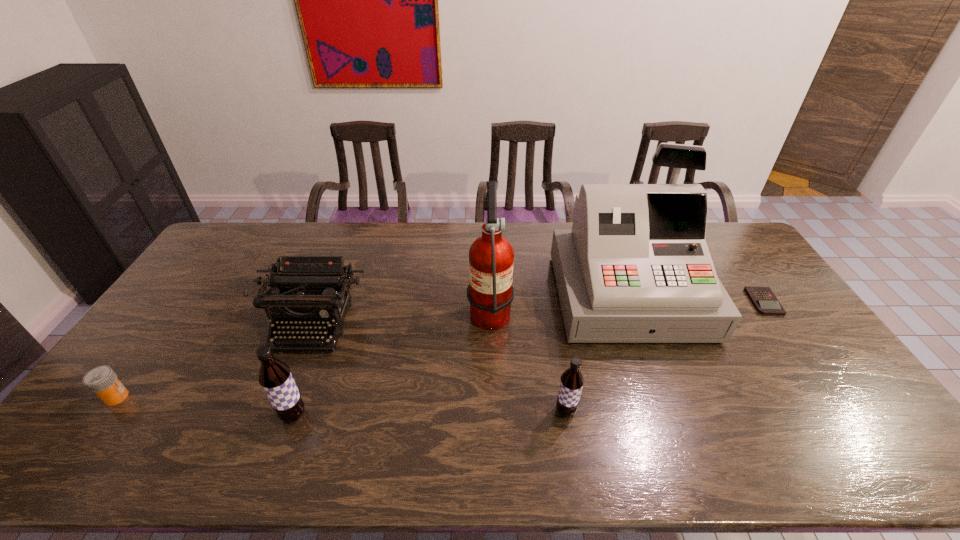
Where is `vacant area that lies between the fourth object from right to left and the typewriter`? The width and height of the screenshot is (960, 540). vacant area that lies between the fourth object from right to left and the typewriter is located at coordinates (401, 317).

Identify the location of empty space that is in between the second object from right to left and the sixth tallest object. (372, 346).

Where is `free spot between the fourth object from right to left and the shorter root beer`? The image size is (960, 540). free spot between the fourth object from right to left and the shorter root beer is located at coordinates (528, 360).

Where is `vacant area that lies between the right root beer and the third tallest object`? Image resolution: width=960 pixels, height=540 pixels. vacant area that lies between the right root beer and the third tallest object is located at coordinates (429, 413).

Where is `free area in between the fourth object from left to right and the second object from right to left`? The image size is (960, 540). free area in between the fourth object from left to right and the second object from right to left is located at coordinates (559, 302).

Locate an element on the screen. This screenshot has width=960, height=540. free space between the calculator and the shorter root beer is located at coordinates (664, 356).

I want to click on free space between the shorter root beer and the medicine, so click(341, 404).

The image size is (960, 540). I want to click on vacant point located between the fourth object from right to left and the sixth tallest object, so click(x=303, y=353).

Image resolution: width=960 pixels, height=540 pixels. Find the location of `free point between the left root beer and the second object from right to left`. free point between the left root beer and the second object from right to left is located at coordinates (461, 355).

Locate an element on the screen. unoccupied area between the cash register and the shorter root beer is located at coordinates (597, 353).